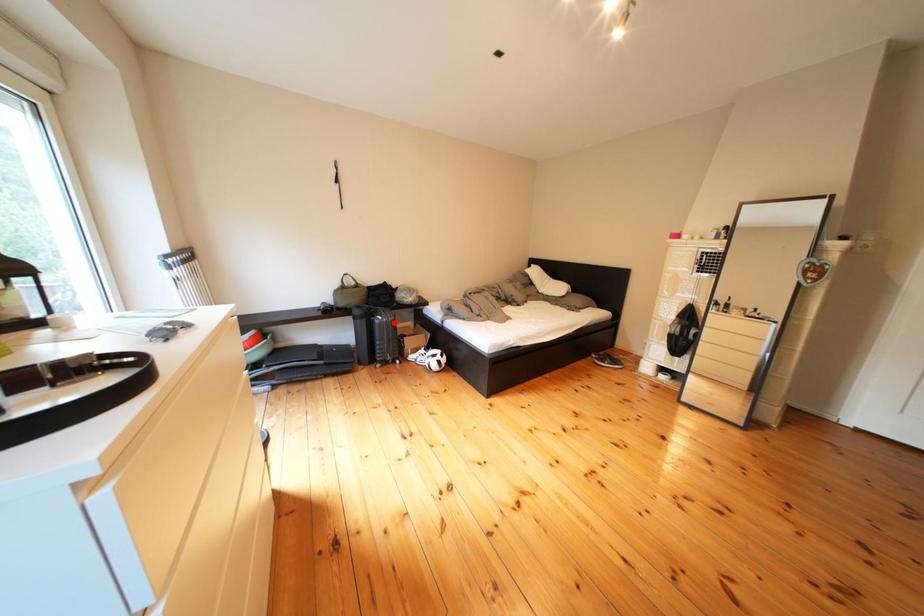
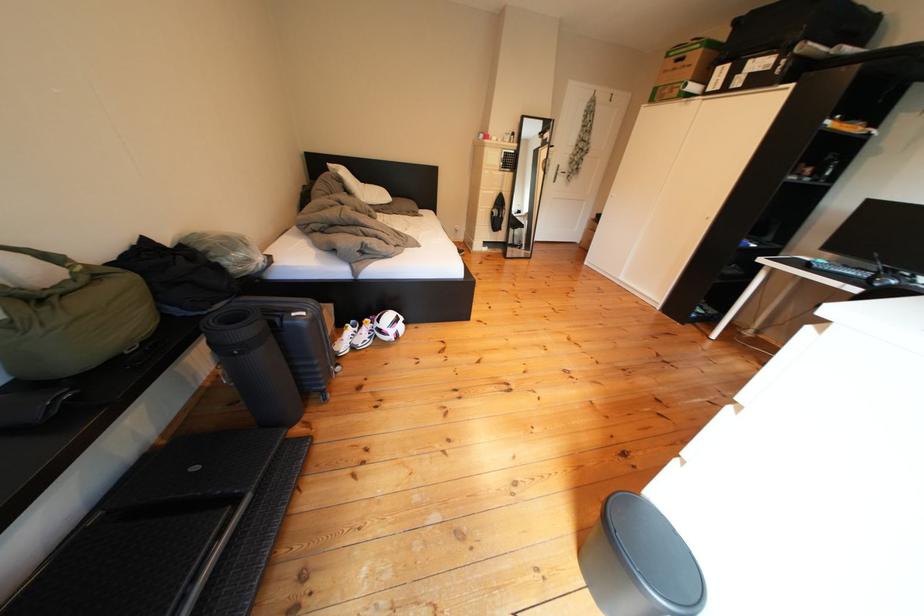
Question: I am providing you with two images of the same scene from different viewpoints. A red point is marked on the first image. Is the red point's position out of view in image 2?

Choices:
 (A) Yes
 (B) No

Answer: (B)